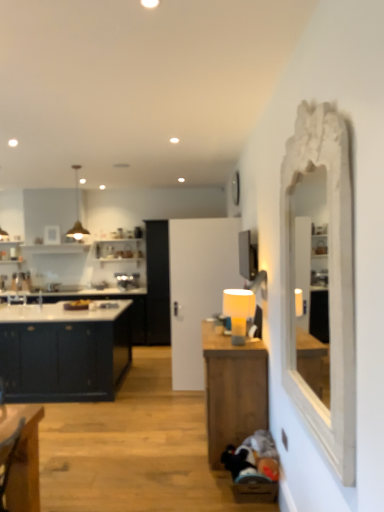
You are a GUI agent. You are given a task and a screenshot of the screen. Output one action in this format:
    pyautogui.click(x=<x>, y=<y>)
    Task: Click on the free space to the left of matte yellow lampshade at center-right
    This screenshot has height=512, width=384.
    Given the screenshot: What is the action you would take?
    pyautogui.click(x=215, y=345)